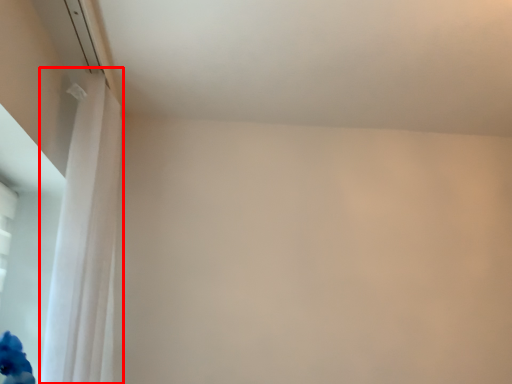
Question: From the image's perspective, considering the relative positions of curtain (annotated by the red box) and window screen in the image provided, where is curtain (annotated by the red box) located with respect to the staircase?

Choices:
 (A) above
 (B) below

Answer: (A)